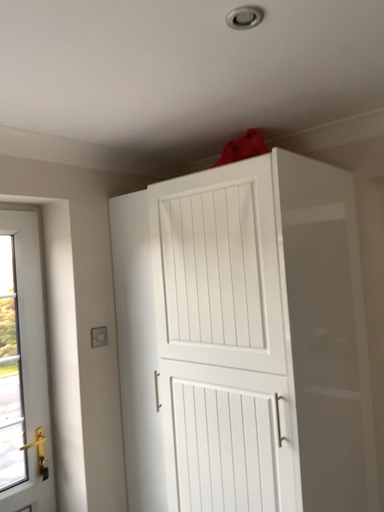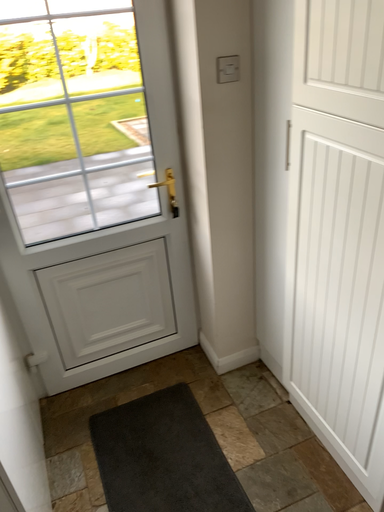
Question: Which way did the camera rotate in the video?

Choices:
 (A) rotated left
 (B) rotated right

Answer: (A)